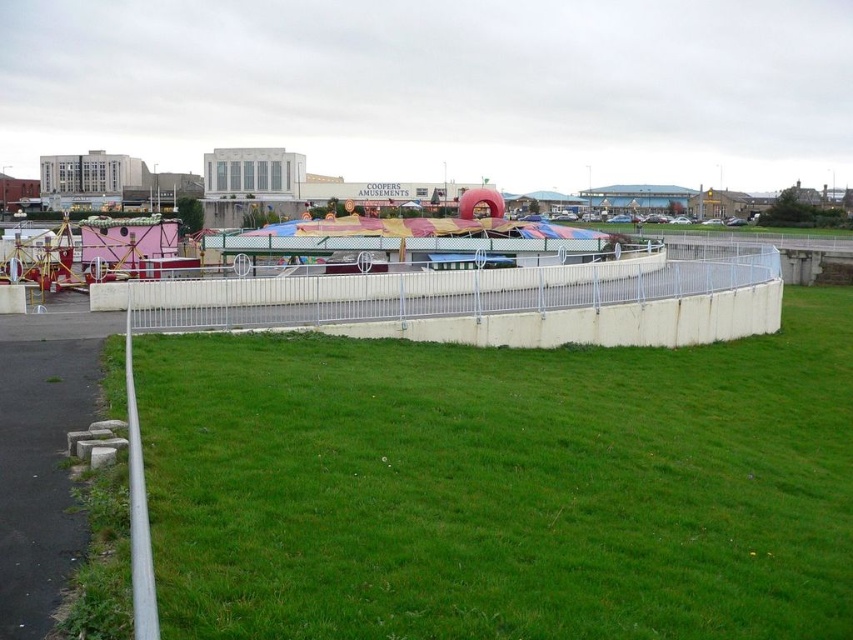
Question: Is green grass at center positioned before multicolored fabric carousel at center?

Choices:
 (A) no
 (B) yes

Answer: (B)

Question: Does green grass at center have a smaller size compared to multicolored fabric carousel at center?

Choices:
 (A) yes
 (B) no

Answer: (A)

Question: Which of the following is the farthest from the observer?

Choices:
 (A) click(428, 545)
 (B) click(363, 252)

Answer: (B)

Question: Is green grass at center closer to the viewer compared to multicolored fabric carousel at center?

Choices:
 (A) yes
 (B) no

Answer: (A)

Question: Which point is closer to the camera?

Choices:
 (A) green grass at center
 (B) multicolored fabric carousel at center

Answer: (A)